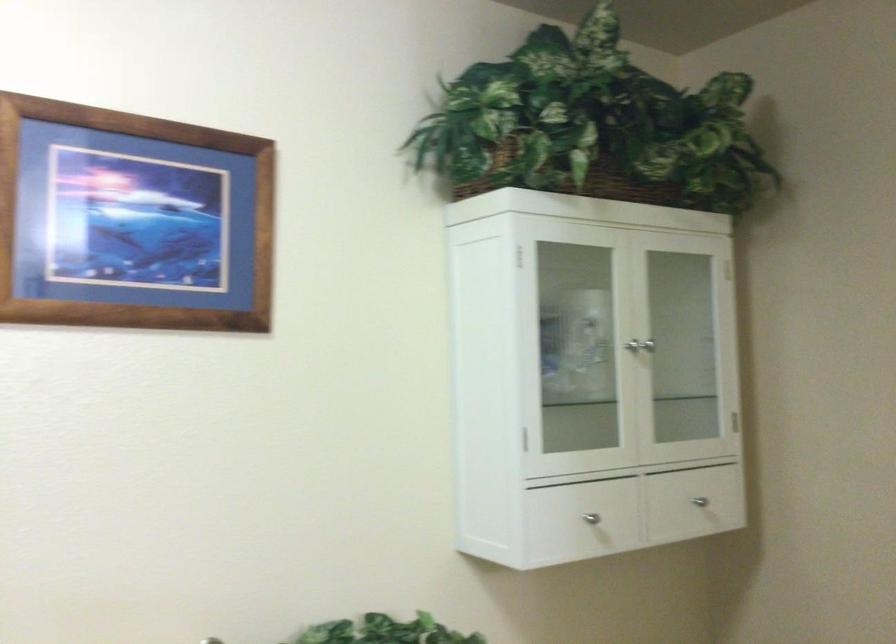
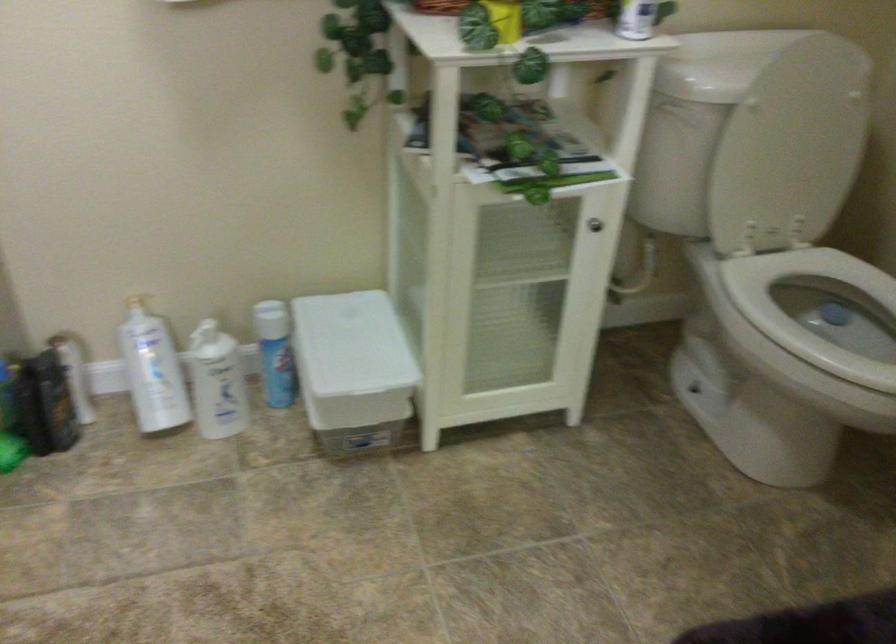
How did the camera likely rotate?

The rotation direction of the camera is left-down.